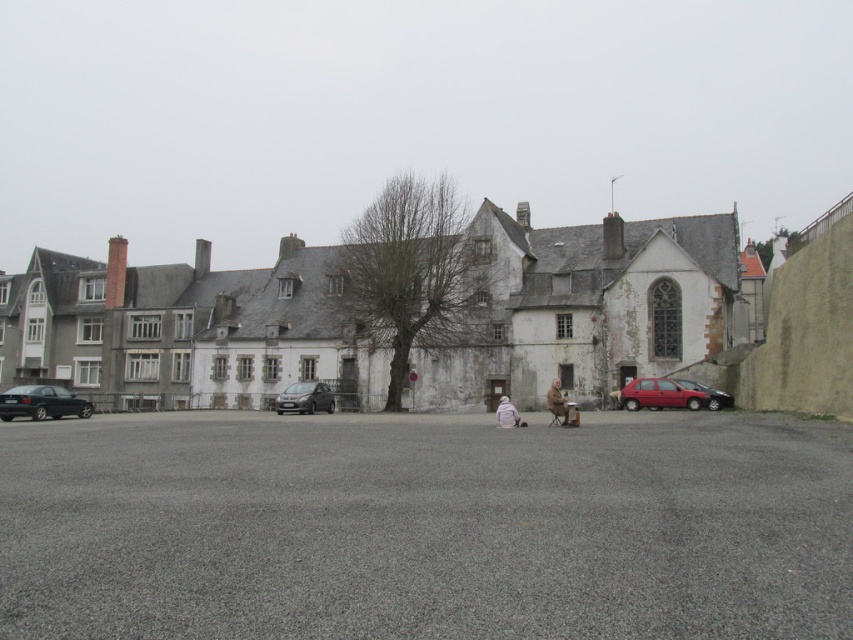
You are a delivery driver who needs to park your truck between the shiny black sedan at left and the matte red hatchback at right. The truck is 2.5 meters wide. Can you fit your truck in the space between them?

The shiny black sedan at left is wider than the matte red hatchback at right. However, the total available space between them depends on their combined widths and positioning. Since the truck requires 2.5 meters, but we only know the sedan is wider than the hatchback, we cannot determine if the space is sufficient without exact measurements.

You are a pedestrian standing at the edge of the paved area in front of the old buildings. You see a shiny black sedan at right and a white woolen sweater at center. Which object is located to the right of the other?

The shiny black sedan at right is positioned on the right side of white woolen sweater at center.